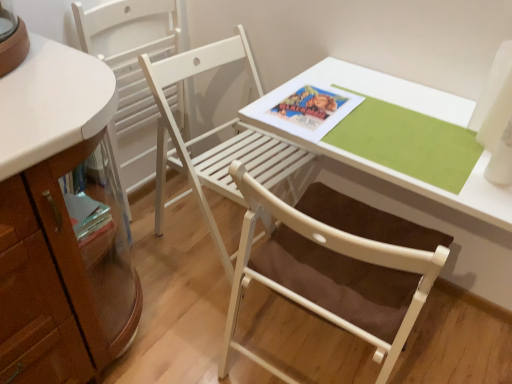
Locate an element on the screen. The image size is (512, 384). vacant space in front of white wood chair at left, the second chair when ordered from right to left is located at coordinates (169, 244).